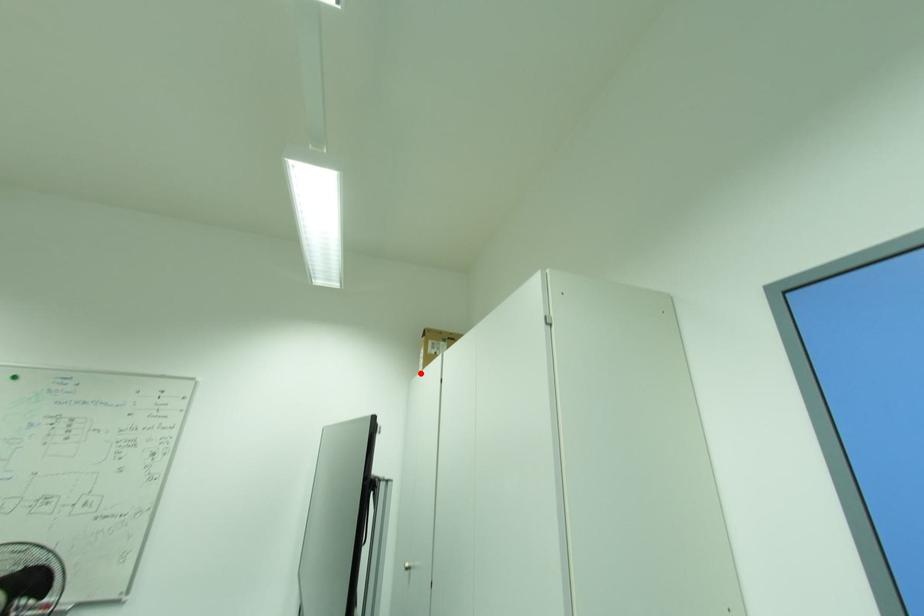
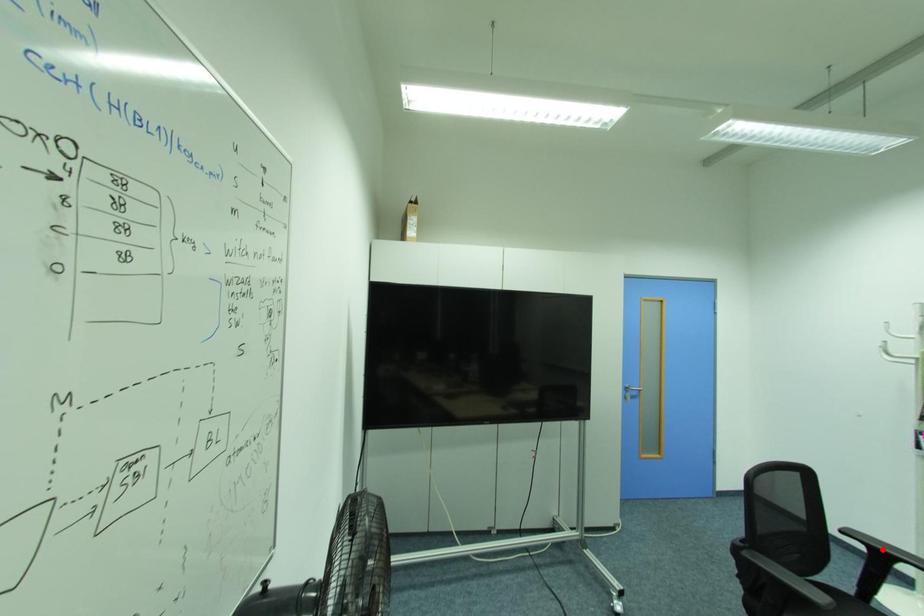
I am providing you with two images of the same scene from different viewpoints. A red point is marked on the first image and another point is marked on the second image. Are the points marked in image1 and image2 representing the same 3D position?

No